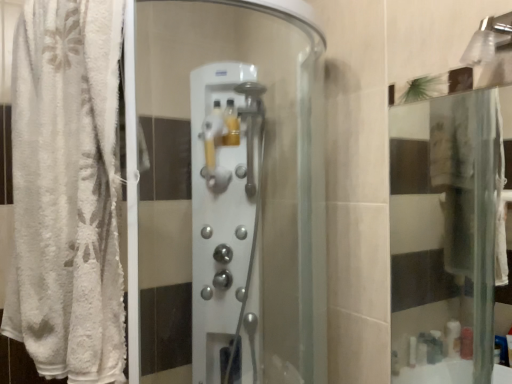
Question: Is white fluffy towel at left completely or partially inside satin silver shower controls at center?

Choices:
 (A) yes
 (B) no

Answer: (B)

Question: Is satin silver shower controls at center in front of white fluffy towel at left?

Choices:
 (A) yes
 (B) no

Answer: (B)

Question: From a real-world perspective, is satin silver shower controls at center physically above white fluffy towel at left?

Choices:
 (A) no
 (B) yes

Answer: (A)

Question: Considering the relative positions of satin silver shower controls at center and white fluffy towel at left in the image provided, is satin silver shower controls at center behind white fluffy towel at left?

Choices:
 (A) yes
 (B) no

Answer: (A)

Question: Considering the relative sizes of satin silver shower controls at center and white fluffy towel at left in the image provided, is satin silver shower controls at center shorter than white fluffy towel at left?

Choices:
 (A) no
 (B) yes

Answer: (A)

Question: From the image's perspective, does satin silver shower controls at center appear lower than white fluffy towel at left?

Choices:
 (A) no
 (B) yes

Answer: (B)

Question: Does white fluffy towel at left have a larger size compared to satin silver shower controls at center?

Choices:
 (A) yes
 (B) no

Answer: (A)

Question: Is white fluffy towel at left looking in the opposite direction of satin silver shower controls at center?

Choices:
 (A) yes
 (B) no

Answer: (A)

Question: Can you confirm if white fluffy towel at left is positioned to the right of satin silver shower controls at center?

Choices:
 (A) yes
 (B) no

Answer: (B)

Question: Is white fluffy towel at left positioned beyond the bounds of satin silver shower controls at center?

Choices:
 (A) no
 (B) yes

Answer: (B)

Question: Considering the relative sizes of white fluffy towel at left and satin silver shower controls at center in the image provided, is white fluffy towel at left wider than satin silver shower controls at center?

Choices:
 (A) no
 (B) yes

Answer: (A)

Question: Is white fluffy towel at left further to the viewer compared to satin silver shower controls at center?

Choices:
 (A) yes
 (B) no

Answer: (B)

Question: Considering the positions of satin silver shower controls at center and white fluffy towel at left in the image, is satin silver shower controls at center taller or shorter than white fluffy towel at left?

Choices:
 (A) short
 (B) tall

Answer: (B)